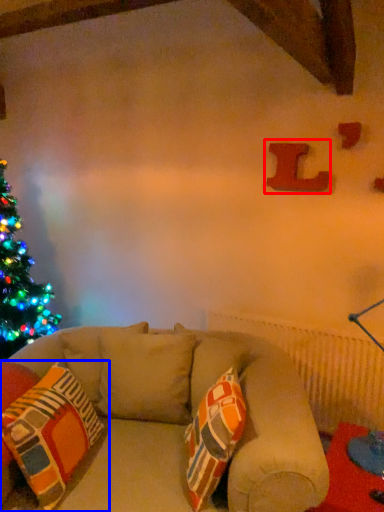
Question: Among these objects, which one is farthest to the camera, alphabet (highlighted by a red box) or pillow (highlighted by a blue box)?

Choices:
 (A) alphabet
 (B) pillow

Answer: (A)